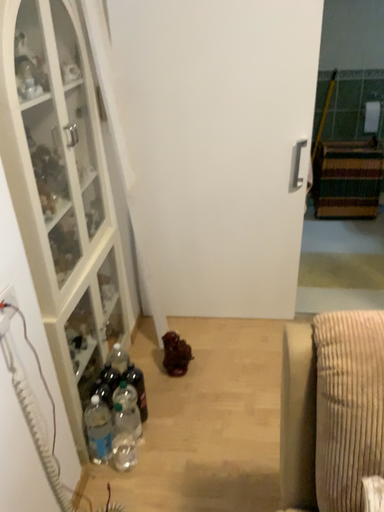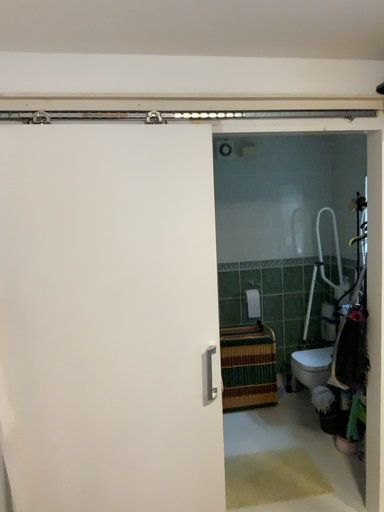
Question: How did the camera likely rotate when shooting the video?

Choices:
 (A) rotated left
 (B) rotated right

Answer: (B)